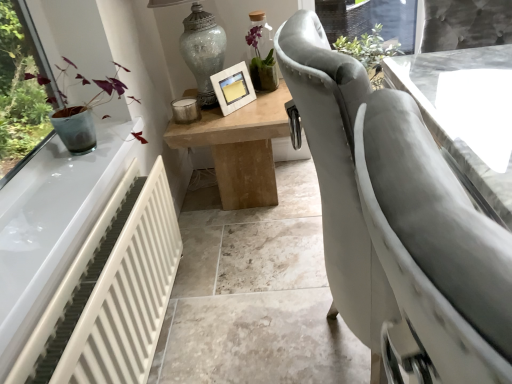
Question: Should I look upward or downward to see light brown wooden table at center, placed as the 2th table when sorted from right to left?

Choices:
 (A) down
 (B) up

Answer: (B)

Question: Is light brown wooden table at center, placed as the 2th table when sorted from right to left, oriented towards white textured picture frame at center?

Choices:
 (A) no
 (B) yes

Answer: (A)

Question: Does light brown wooden table at center, which is the first table from left to right, have a lesser height compared to white textured picture frame at center?

Choices:
 (A) no
 (B) yes

Answer: (A)

Question: From the image's perspective, is light brown wooden table at center, placed as the 2th table when sorted from right to left, above white textured picture frame at center?

Choices:
 (A) yes
 (B) no

Answer: (B)

Question: Is light brown wooden table at center, which is the first table from left to right, surrounding white textured picture frame at center?

Choices:
 (A) yes
 (B) no

Answer: (B)

Question: From a real-world perspective, is light brown wooden table at center, placed as the 2th table when sorted from right to left, physically below white textured picture frame at center?

Choices:
 (A) no
 (B) yes

Answer: (B)

Question: Considering the relative sizes of light brown wooden table at center, which is the first table from left to right, and white textured picture frame at center in the image provided, is light brown wooden table at center, which is the first table from left to right, taller than white textured picture frame at center?

Choices:
 (A) no
 (B) yes

Answer: (B)

Question: Is white textured picture frame at center facing away from light brown wooden table at center, which is the first table from left to right?

Choices:
 (A) yes
 (B) no

Answer: (B)

Question: From a real-world perspective, is white textured picture frame at center located higher than light brown wooden table at center, which is the first table from left to right?

Choices:
 (A) yes
 (B) no

Answer: (A)

Question: Considering the relative positions of white textured picture frame at center and light brown wooden table at center, placed as the 2th table when sorted from right to left, in the image provided, is white textured picture frame at center to the right of light brown wooden table at center, placed as the 2th table when sorted from right to left, from the viewer's perspective?

Choices:
 (A) yes
 (B) no

Answer: (B)

Question: Is white textured picture frame at center at the left side of light brown wooden table at center, placed as the 2th table when sorted from right to left?

Choices:
 (A) no
 (B) yes

Answer: (B)

Question: From the image's perspective, is white textured picture frame at center on top of light brown wooden table at center, which is the first table from left to right?

Choices:
 (A) yes
 (B) no

Answer: (A)

Question: From the image's perspective, is white textured picture frame at center under light brown wooden table at center, placed as the 2th table when sorted from right to left?

Choices:
 (A) no
 (B) yes

Answer: (A)

Question: From the image's perspective, is white glossy table at center, positioned as the 2th table in left-to-right order, on top of crackle glass vase at upper center?

Choices:
 (A) yes
 (B) no

Answer: (B)